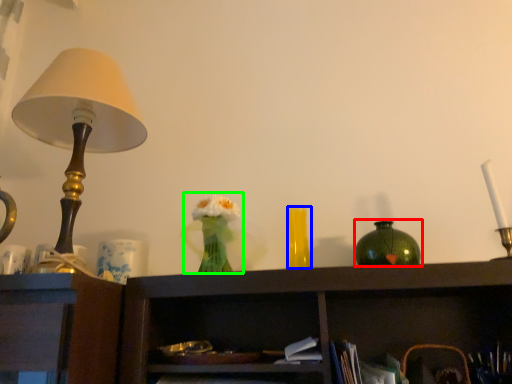
Question: Which object is the farthest from vase (highlighted by a red box)? Choose among these: vase (highlighted by a blue box) or floral arrangement (highlighted by a green box).

Choices:
 (A) vase
 (B) floral arrangement

Answer: (B)